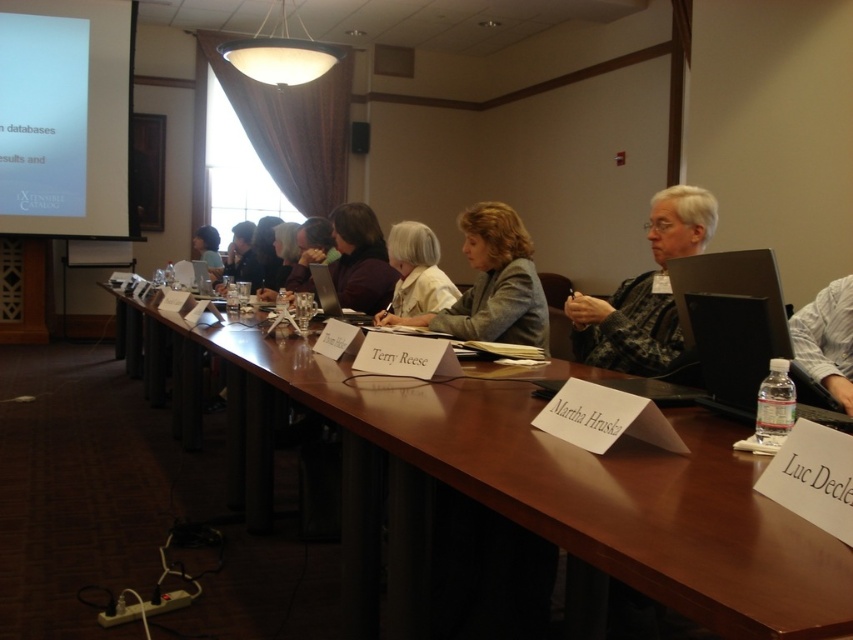
Question: Is black plastic laptop at right wider than black glossy laptop at center?

Choices:
 (A) no
 (B) yes

Answer: (B)

Question: Which object appears closest to the camera in this image?

Choices:
 (A) white matte shirt at center
 (B) white matte projection screen at upper left
 (C) matte black laptop at upper center

Answer: (A)

Question: Among these objects, which one is farthest from the camera?

Choices:
 (A) brown wood table at center
 (B) white matte projection screen at upper left
 (C) plaid fabric shirt at center
 (D) black plastic laptop at right

Answer: (B)

Question: Does brown wood table at center appear over white matte shirt at center?

Choices:
 (A) no
 (B) yes

Answer: (A)

Question: Does light gray fabric jacket at center appear on the right side of white matte shirt at center?

Choices:
 (A) yes
 (B) no

Answer: (A)

Question: Which of the following is the closest to the observer?

Choices:
 (A) (67, 176)
 (B) (509, 336)
 (C) (729, 404)
 (D) (651, 320)

Answer: (C)